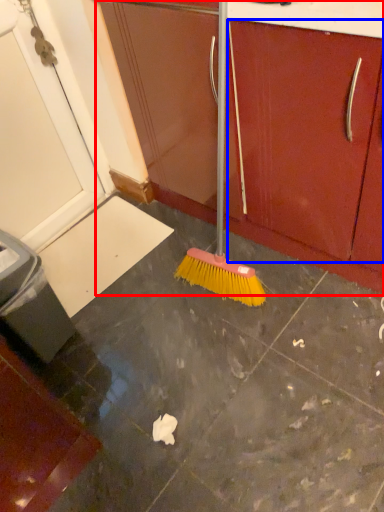
Question: Which object is further to the camera taking this photo, cabinetry (highlighted by a red box) or drawer (highlighted by a blue box)?

Choices:
 (A) cabinetry
 (B) drawer

Answer: (A)